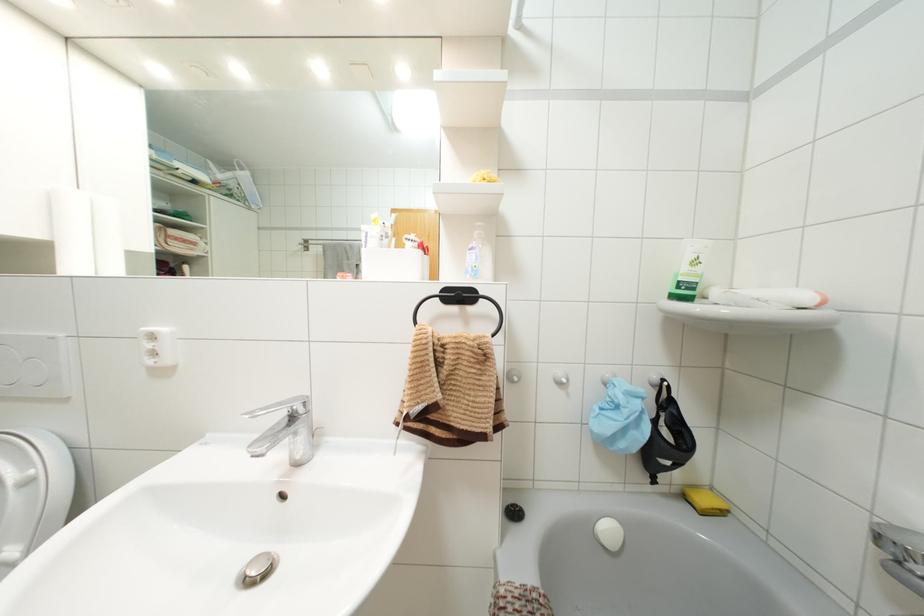
The height and width of the screenshot is (616, 924). In order to click on metal faucet handle in this screenshot , I will do `click(283, 407)`.